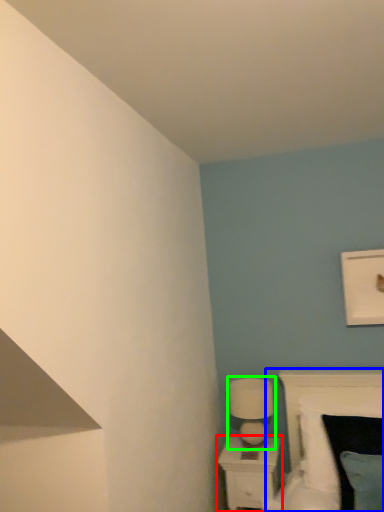
Question: Estimate the real-world distances between objects in this image. Which object is closer to nightstand (highlighted by a red box), bed (highlighted by a blue box) or table lamp (highlighted by a green box)?

Choices:
 (A) bed
 (B) table lamp

Answer: (B)